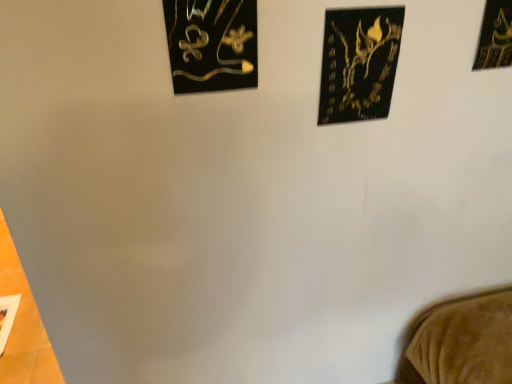
Question: Is black matte picture frame at upper center, the 2th picture frame from the left, wider than black matte picture frame at upper right, acting as the first picture frame starting from the right?

Choices:
 (A) no
 (B) yes

Answer: (A)

Question: Is black matte picture frame at upper center, marked as the 2th picture frame in a right-to-left arrangement, further to camera compared to black matte picture frame at upper right, acting as the 3th picture frame starting from the left?

Choices:
 (A) no
 (B) yes

Answer: (A)

Question: Can you confirm if black matte picture frame at upper center, the 2th picture frame from the left, is positioned to the left of black matte picture frame at upper right, acting as the first picture frame starting from the right?

Choices:
 (A) no
 (B) yes

Answer: (B)

Question: Is black matte picture frame at upper center, the 2th picture frame from the left, oriented towards black matte picture frame at upper right, acting as the 3th picture frame starting from the left?

Choices:
 (A) no
 (B) yes

Answer: (A)

Question: Is black matte picture frame at upper center, marked as the 2th picture frame in a right-to-left arrangement, closer to the viewer compared to black matte picture frame at upper right, acting as the first picture frame starting from the right?

Choices:
 (A) no
 (B) yes

Answer: (B)

Question: Based on their positions, is metallic gold artwork at upper left, the third picture frame when ordered from right to left, located to the left or right of black matte picture frame at upper right, acting as the first picture frame starting from the right?

Choices:
 (A) left
 (B) right

Answer: (A)

Question: Considering their positions, is metallic gold artwork at upper left, arranged as the 1th picture frame when viewed from the left, located in front of or behind black matte picture frame at upper right, acting as the 3th picture frame starting from the left?

Choices:
 (A) behind
 (B) front

Answer: (B)

Question: Is metallic gold artwork at upper left, arranged as the 1th picture frame when viewed from the left, wider or thinner than black matte picture frame at upper right, acting as the 3th picture frame starting from the left?

Choices:
 (A) wide
 (B) thin

Answer: (B)

Question: From the image's perspective, relative to black matte picture frame at upper right, acting as the 3th picture frame starting from the left, is metallic gold artwork at upper left, arranged as the 1th picture frame when viewed from the left, above or below?

Choices:
 (A) below
 (B) above

Answer: (A)

Question: In terms of size, does metallic gold artwork at upper left, the third picture frame when ordered from right to left, appear bigger or smaller than black matte picture frame at upper center, the 2th picture frame from the left?

Choices:
 (A) small
 (B) big

Answer: (B)

Question: From a real-world perspective, is metallic gold artwork at upper left, arranged as the 1th picture frame when viewed from the left, above or below black matte picture frame at upper center, marked as the 2th picture frame in a right-to-left arrangement?

Choices:
 (A) below
 (B) above

Answer: (B)

Question: Choose the correct answer: Is metallic gold artwork at upper left, arranged as the 1th picture frame when viewed from the left, inside black matte picture frame at upper center, marked as the 2th picture frame in a right-to-left arrangement, or outside it?

Choices:
 (A) inside
 (B) outside

Answer: (B)

Question: From the image's perspective, is metallic gold artwork at upper left, arranged as the 1th picture frame when viewed from the left, located above or below black matte picture frame at upper center, marked as the 2th picture frame in a right-to-left arrangement?

Choices:
 (A) below
 (B) above

Answer: (B)

Question: From a real-world perspective, is black matte picture frame at upper right, acting as the 3th picture frame starting from the left, physically located above or below metallic gold artwork at upper left, arranged as the 1th picture frame when viewed from the left?

Choices:
 (A) below
 (B) above

Answer: (B)

Question: Looking at their shapes, would you say black matte picture frame at upper right, acting as the 3th picture frame starting from the left, is wider or thinner than metallic gold artwork at upper left, the third picture frame when ordered from right to left?

Choices:
 (A) thin
 (B) wide

Answer: (B)